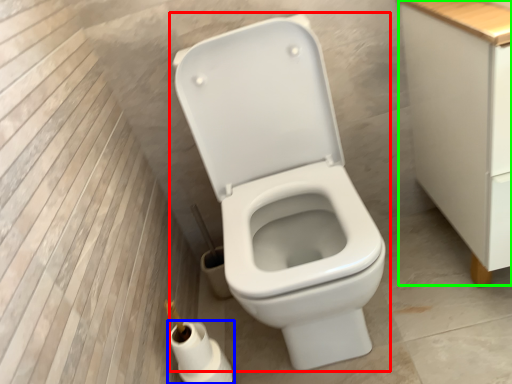
Question: Which object is positioned farthest from toilet (highlighted by a red box)? Select from toilet paper (highlighted by a blue box) and cabinetry (highlighted by a green box).

Choices:
 (A) toilet paper
 (B) cabinetry

Answer: (A)